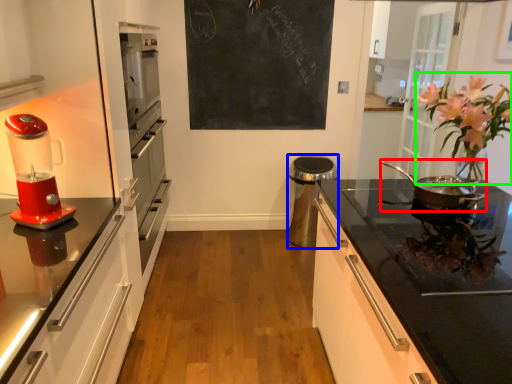
Question: Considering the real-world distances, which object is farthest from kitchen appliance (highlighted by a red box)? appliance (highlighted by a blue box) or floral arrangement (highlighted by a green box)?

Choices:
 (A) appliance
 (B) floral arrangement

Answer: (A)